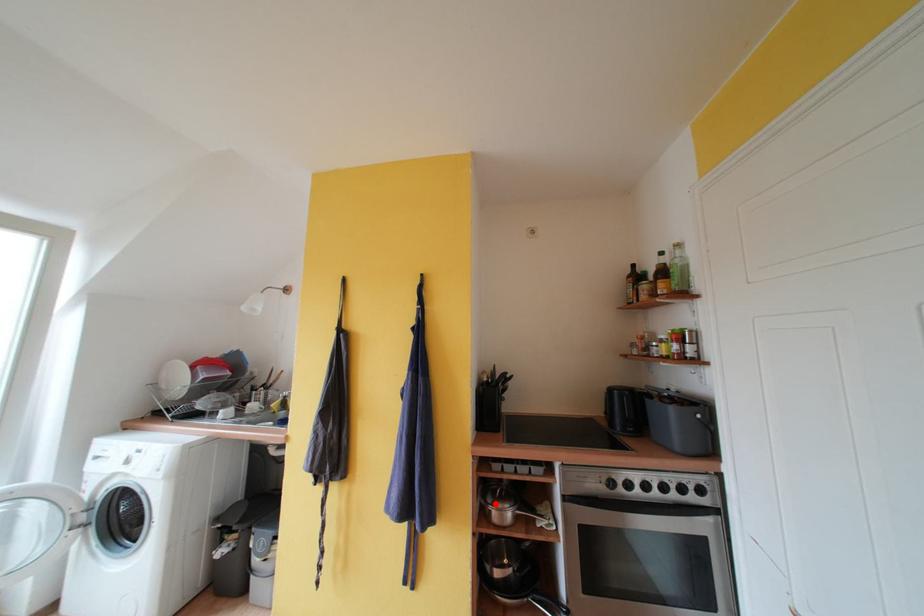
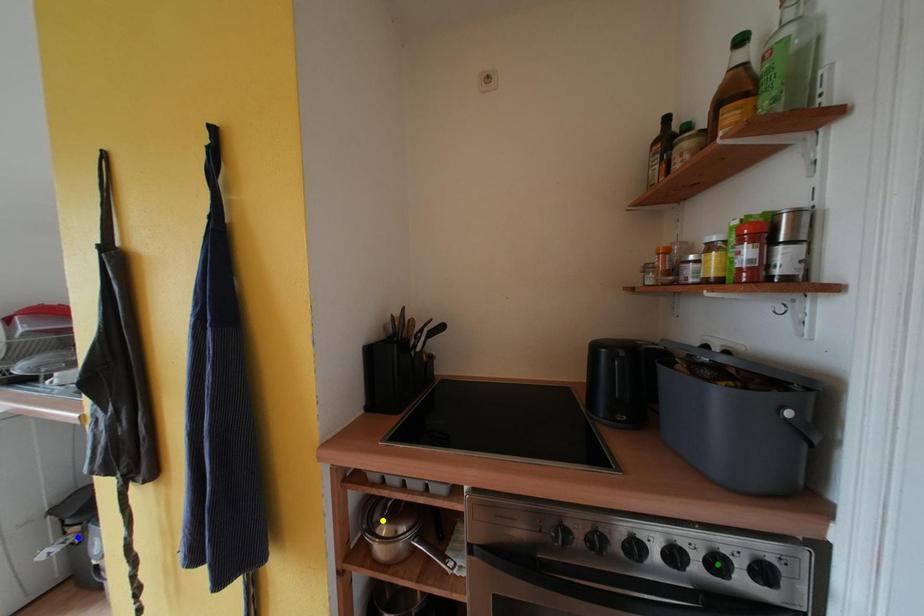
Question: I am providing you with two images of the same scene from different viewpoints. A red point is marked on the first image. You are given multiple points on the second image. Which spot in image 2 lines up with the point in image 1?

Choices:
 (A) yellow point
 (B) blue point
 (C) green point

Answer: (A)